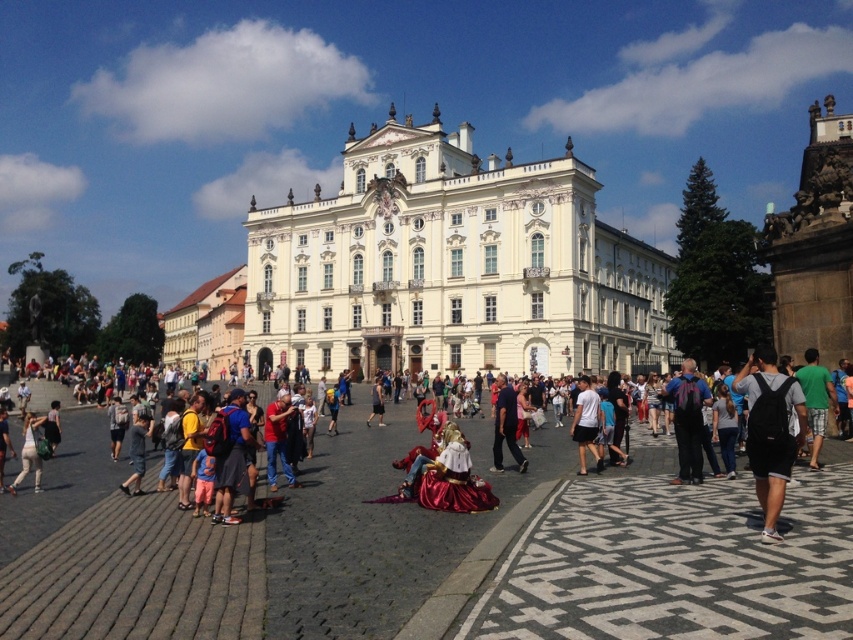
Question: Is black backpack at lower right bigger than dark blue shirt at center?

Choices:
 (A) no
 (B) yes

Answer: (B)

Question: Among these objects, which one is nearest to the camera?

Choices:
 (A) smooth stone pavement at center
 (B) black backpack at lower right

Answer: (A)

Question: Which of these objects is positioned farthest from the smooth stone pavement at center?

Choices:
 (A) dark blue fabric at center
 (B) black backpack at lower right
 (C) white stone building at center
 (D) dark blue shirt at center

Answer: (C)

Question: Can you confirm if smooth stone pavement at center is smaller than black backpack at lower right?

Choices:
 (A) yes
 (B) no

Answer: (B)

Question: Which of the following is the closest to the observer?

Choices:
 (A) (614, 552)
 (B) (252, 269)
 (C) (378, 381)
 (D) (495, 424)

Answer: (A)

Question: Does white stone building at center appear on the left side of dark blue shirt at center?

Choices:
 (A) yes
 (B) no

Answer: (A)